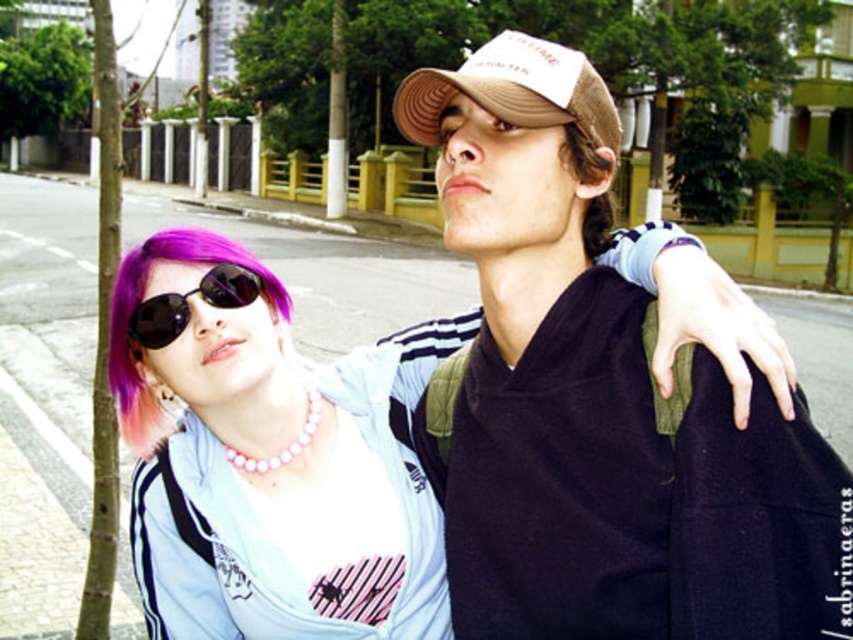
You are a photographer adjusting your camera to focus on two points in the image. The first point is point (300,625) and the second is point (561,154). Which point is closer to the camera?

Point (300,625) is further to the camera than point (561,154), so the second point is closer to the camera.

Looking at the two people in the image, which object is positioned to the left of the other between the black reflective sunglasses at upper left and the brown matte hair at upper center?

The black reflective sunglasses at upper left are positioned to the left of the brown matte hair at upper center.

You are a photographer trying to adjust the framing of the image to ensure both the brown mesh cap at upper center and the brown matte hair at upper center are clearly visible. Based on their positions, which object should you focus on first to ensure both are in frame?

The brown mesh cap at upper center is located below brown matte hair at upper center. To ensure both are in frame, focus on the brown matte hair at upper center first as it is higher up, allowing the camera to capture both objects by adjusting the framing downward.